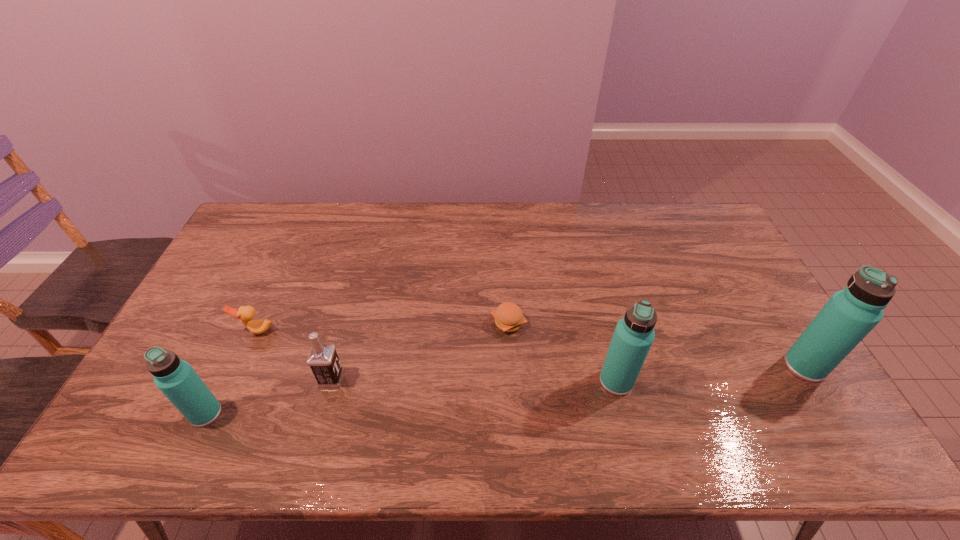
Where is `unoccupied area between the vodka and the third tallest object`? The image size is (960, 540). unoccupied area between the vodka and the third tallest object is located at coordinates (269, 396).

In order to click on free space between the duck and the second thermos bottle from right to left in this screenshot , I will do point(437,356).

Locate an element on the screen. This screenshot has width=960, height=540. vacant area that lies between the fourth object from left to right and the nearest object is located at coordinates (357, 368).

Where is `unoccupied area between the fifth tallest object and the hamburger`? The width and height of the screenshot is (960, 540). unoccupied area between the fifth tallest object and the hamburger is located at coordinates (382, 327).

At what (x,y) coordinates should I click in order to perform the action: click on free space between the rightmost thermos bottle and the third object from right to left. Please return your answer as a coordinate pair (x, y). The height and width of the screenshot is (540, 960). Looking at the image, I should click on (657, 345).

Choose which object is the nearest neighbor to the duck. Please provide its 2D coordinates. Your answer should be formatted as a tuple, i.e. [(x, y)], where the tuple contains the x and y coordinates of a point satisfying the conditions above.

[(323, 360)]

Select which object appears as the closest to the fifth tallest object. Please provide its 2D coordinates. Your answer should be formatted as a tuple, i.e. [(x, y)], where the tuple contains the x and y coordinates of a point satisfying the conditions above.

[(323, 360)]

Locate which thermos bottle is the closest to the shortest thermos bottle. Please provide its 2D coordinates. Your answer should be formatted as a tuple, i.e. [(x, y)], where the tuple contains the x and y coordinates of a point satisfying the conditions above.

[(634, 334)]

Identify the location of thermos bottle that is the second nearest to the fifth object from left to right. (176, 379).

At what (x,y) coordinates should I click in order to perform the action: click on free space that satisfies the following two spatial constraints: 1. on the front label of the vodka; 2. on the front side of the third tallest object. Please return your answer as a coordinate pair (x, y). The image size is (960, 540). Looking at the image, I should click on (322, 414).